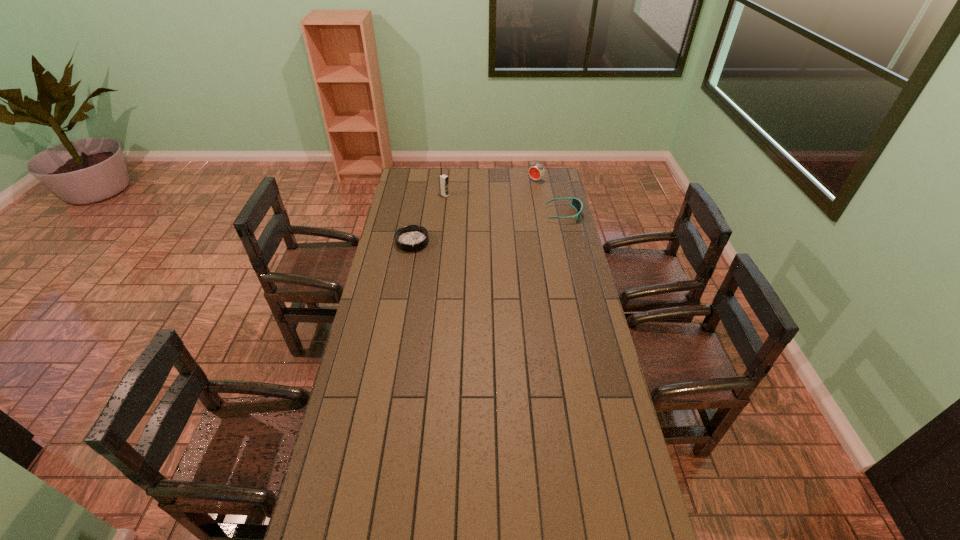
This screenshot has width=960, height=540. What are the coordinates of `free region located 0.390m on the face of the farthest object` in the screenshot? It's located at (492, 215).

Locate an element on the screen. This screenshot has width=960, height=540. free space located 0.260m on the face of the farthest object is located at coordinates (506, 204).

Find the location of a particular element. Image resolution: width=960 pixels, height=540 pixels. vacant space located on the front-facing side of the cellular telephone is located at coordinates (463, 203).

I want to click on free space located on the front-facing side of the cellular telephone, so click(x=501, y=220).

Where is `free spot located on the front-facing side of the cellular telephone`? This screenshot has width=960, height=540. free spot located on the front-facing side of the cellular telephone is located at coordinates (503, 220).

The height and width of the screenshot is (540, 960). I want to click on object at the far edge, so click(537, 171).

This screenshot has height=540, width=960. I want to click on object at the left edge, so [x=411, y=238].

The image size is (960, 540). Find the location of `sunglasses at the right edge`. sunglasses at the right edge is located at coordinates (576, 203).

You are a GUI agent. You are given a task and a screenshot of the screen. Output one action in this format:
    pyautogui.click(x=<x>, y=<y>)
    Task: Click on the alarm clock at the right edge
    
    Given the screenshot: What is the action you would take?
    point(537,171)

Where is `object that is at the far right corner`? Image resolution: width=960 pixels, height=540 pixels. object that is at the far right corner is located at coordinates (537, 171).